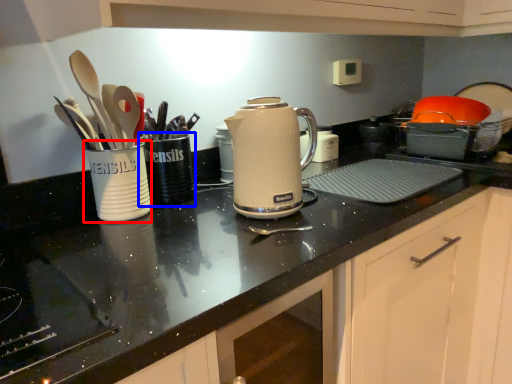
Question: Which of the following is the closest to the observer, tableware (highlighted by a red box) or tableware (highlighted by a blue box)?

Choices:
 (A) tableware
 (B) tableware

Answer: (A)